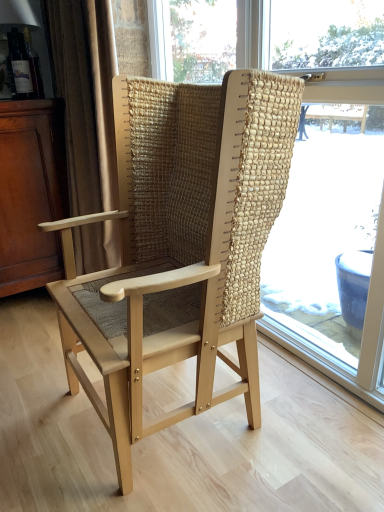
Find the location of a particular element. vacant point to the left of natural wood chair at center is located at coordinates (34, 425).